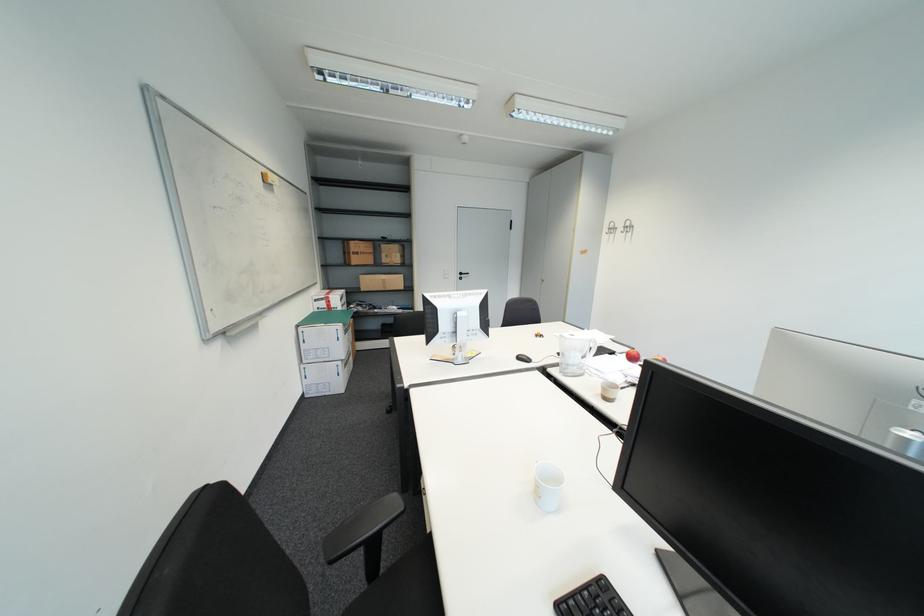
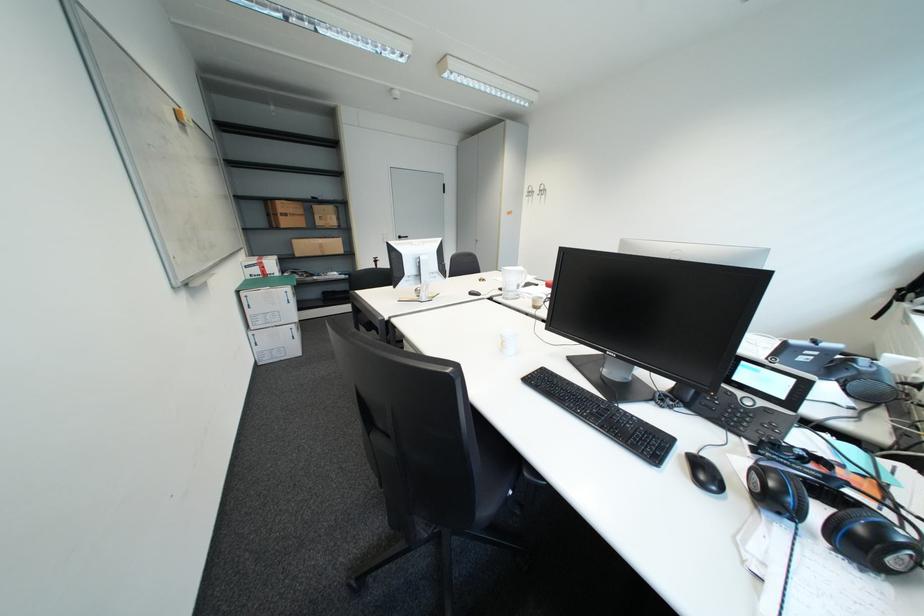
Which direction would the cameraman need to move to produce the second image?

The movement direction of the cameraman is left, backward.